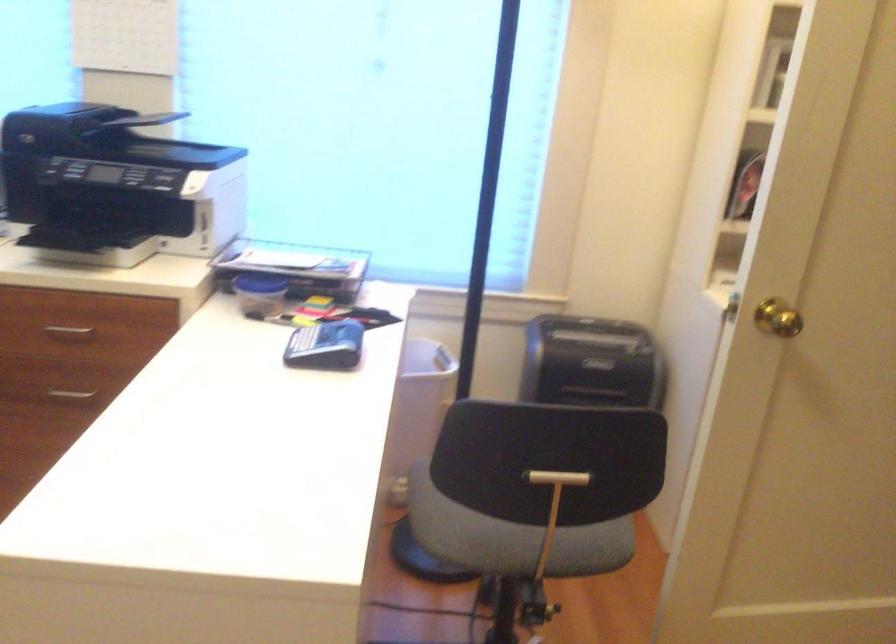
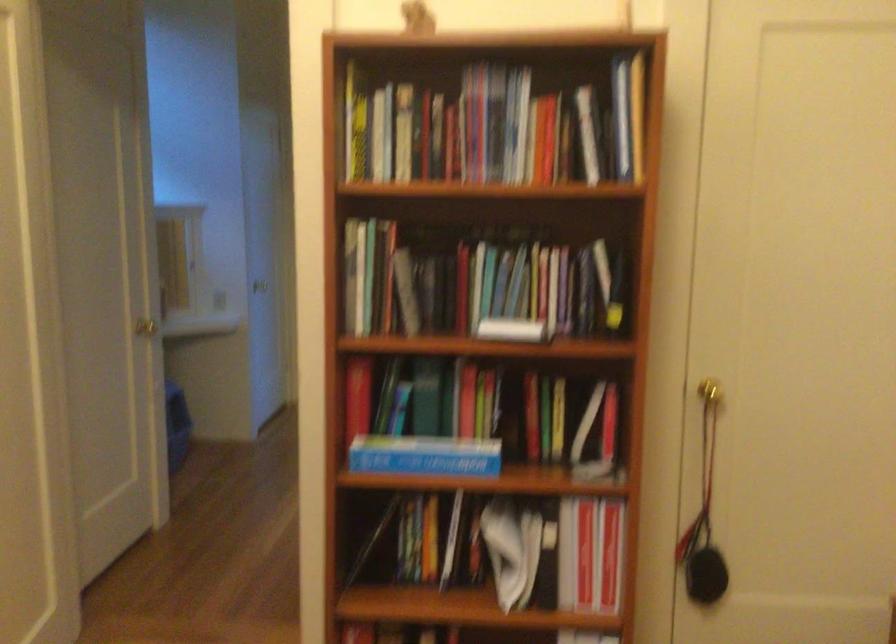
Question: The first image is from the beginning of the video and the second image is from the end. How did the camera likely rotate when shooting the video?

Choices:
 (A) Left
 (B) Right
 (C) Up
 (D) Down

Answer: (B)